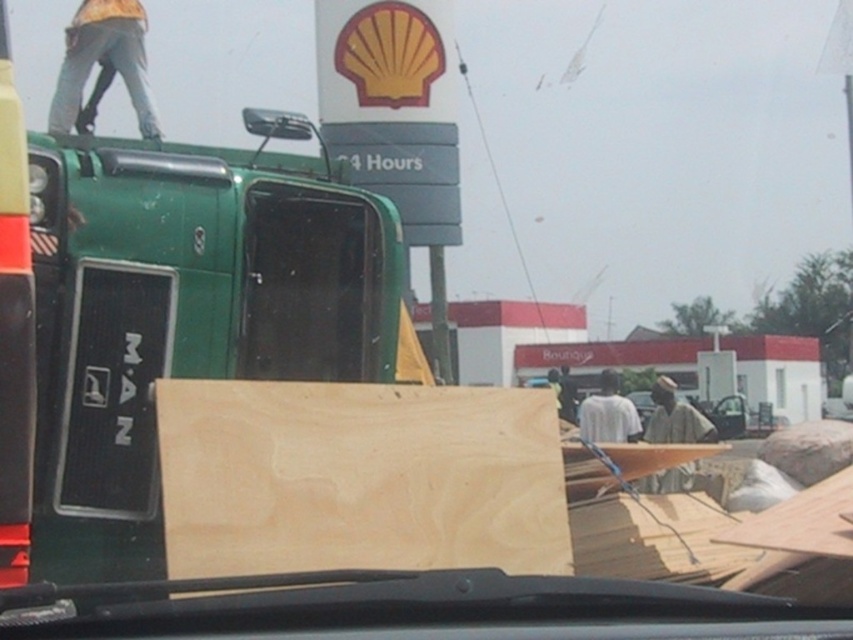
Which of these two, transparent glass windshield at center or white matte shirt at center, stands shorter?

transparent glass windshield at center

Between point (376, 298) and point (590, 429), which one is positioned in front?

Point (376, 298) is in front.

The height and width of the screenshot is (640, 853). In order to click on transparent glass windshield at center in this screenshot , I will do `click(308, 284)`.

Does transparent glass windshield at center have a lesser height compared to matte green truck at left?

Indeed, transparent glass windshield at center has a lesser height compared to matte green truck at left.

Does transparent glass windshield at center have a larger size compared to matte green truck at left?

Correct, transparent glass windshield at center is larger in size than matte green truck at left.

Who is more distant from viewer, (305, 266) or (22, 410)?

The point (305, 266) is more distant.

Where is `transparent glass windshield at center`? This screenshot has height=640, width=853. transparent glass windshield at center is located at coordinates (308, 284).

Is matte green truck at left shorter than white matte shirt at center?

Indeed, matte green truck at left has a lesser height compared to white matte shirt at center.

Which is behind, point (16, 118) or point (610, 417)?

Point (610, 417)

Image resolution: width=853 pixels, height=640 pixels. I want to click on matte green truck at left, so click(15, 340).